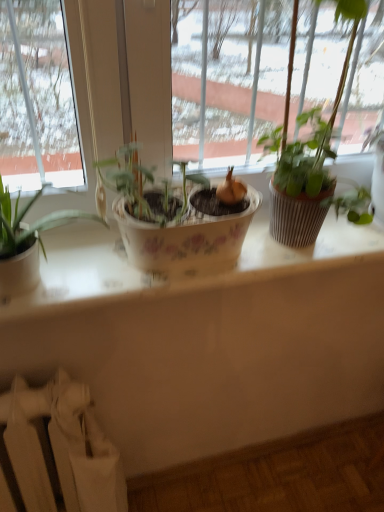
Question: From a real-world perspective, relative to green matte plant at upper right, is white fabric radiator at lower left vertically above or below?

Choices:
 (A) below
 (B) above

Answer: (A)

Question: Considering the relative positions of white fabric radiator at lower left and green matte plant at upper right in the image provided, is white fabric radiator at lower left to the left or to the right of green matte plant at upper right?

Choices:
 (A) left
 (B) right

Answer: (A)

Question: Is white fabric radiator at lower left wider or thinner than green matte plant at upper right?

Choices:
 (A) wide
 (B) thin

Answer: (A)

Question: Is green matte plant at upper right taller or shorter than white fabric radiator at lower left?

Choices:
 (A) tall
 (B) short

Answer: (B)

Question: Considering the positions of green matte plant at upper right and white fabric radiator at lower left in the image, is green matte plant at upper right bigger or smaller than white fabric radiator at lower left?

Choices:
 (A) small
 (B) big

Answer: (A)

Question: Is green matte plant at upper right wider or thinner than white fabric radiator at lower left?

Choices:
 (A) wide
 (B) thin

Answer: (B)

Question: From a real-world perspective, is green matte plant at upper right positioned above or below white fabric radiator at lower left?

Choices:
 (A) below
 (B) above

Answer: (B)